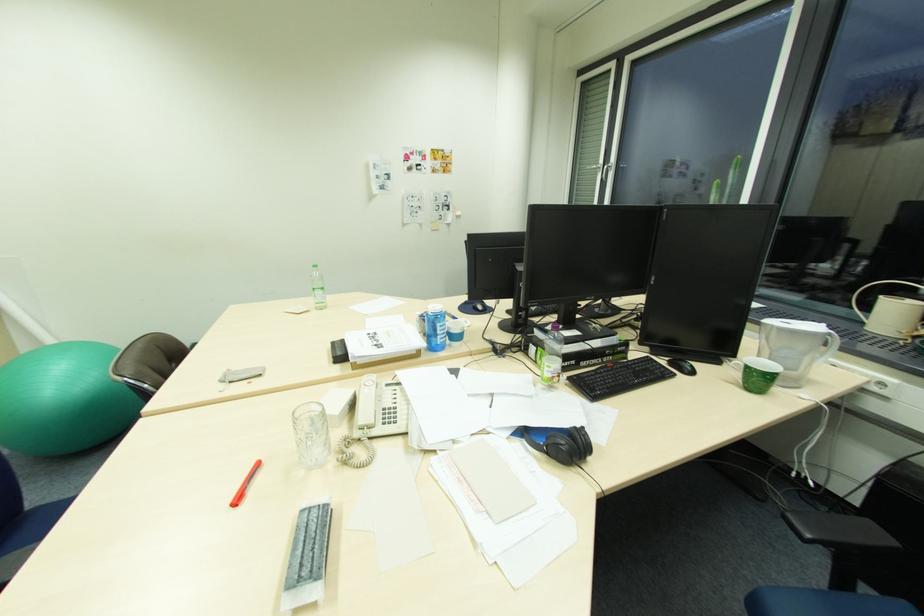
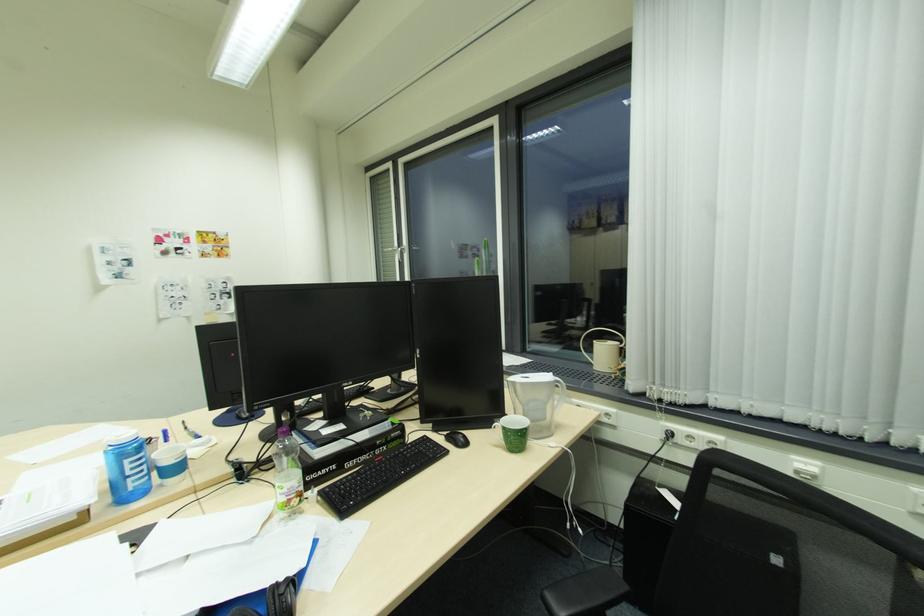
The point at (448, 334) is marked in the first image. Where is the corresponding point in the second image?

(146, 472)